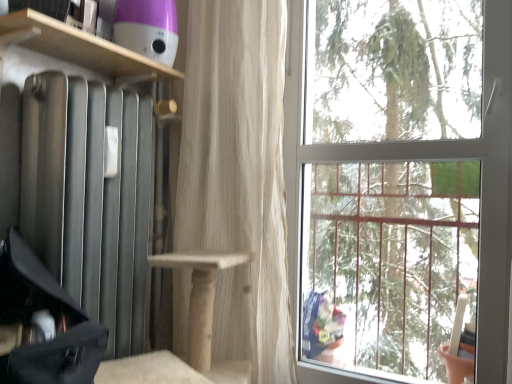
From the picture: What is the approximate height of white sheer curtain at center?

It is 1.56 meters.

This screenshot has height=384, width=512. In order to click on transparent glass window at upper right in this screenshot , I will do `click(399, 181)`.

Find the location of `wooden shelf at upper left`. wooden shelf at upper left is located at coordinates (82, 47).

At what (x,y) coordinates should I click in order to perform the action: click on black fabric suitcase at left. Please return your answer as a coordinate pair (x, y). Looking at the image, I should click on (51, 316).

Is white sheer curtain at center taller than transparent glass window at upper right?

Yes, white sheer curtain at center is taller than transparent glass window at upper right.

Looking at this image, is white sheer curtain at center not within transparent glass window at upper right?

white sheer curtain at center is positioned outside transparent glass window at upper right.

Consider the image. Could you tell me if white sheer curtain at center is turned towards transparent glass window at upper right?

No, white sheer curtain at center is not facing towards transparent glass window at upper right.

Is white sheer curtain at center wider or thinner than wooden shelf at upper left?

white sheer curtain at center is thinner than wooden shelf at upper left.

From a real-world perspective, who is located lower, white sheer curtain at center or wooden shelf at upper left?

white sheer curtain at center is physically lower.

Is white sheer curtain at center looking in the opposite direction of wooden shelf at upper left?

No, white sheer curtain at center is not facing the opposite direction of wooden shelf at upper left.

Which is behind, point (266, 6) or point (101, 62)?

The point (266, 6) is farther.

How distant is transparent glass window at upper right from wooden shelf at upper left?

The distance of transparent glass window at upper right from wooden shelf at upper left is 35.01 inches.

Does point (500, 334) lie in front of point (90, 52)?

No, it is not.

Are transparent glass window at upper right and wooden shelf at upper left beside each other?

No, transparent glass window at upper right is not with wooden shelf at upper left.

From a real-world perspective, between transparent glass window at upper right and wooden shelf at upper left, who is vertically lower?

From a 3D spatial view, transparent glass window at upper right is below.

From a real-world perspective, is black fabric suitcase at left physically above wooden shelf at upper left?

No.

Which object is positioned more to the left, black fabric suitcase at left or wooden shelf at upper left?

black fabric suitcase at left.

Is wooden shelf at upper left inside black fabric suitcase at left?

No, wooden shelf at upper left is located outside of black fabric suitcase at left.

Considering the sizes of objects black fabric suitcase at left and wooden shelf at upper left in the image provided, who is shorter, black fabric suitcase at left or wooden shelf at upper left?

wooden shelf at upper left is shorter.

Can you confirm if wooden shelf at upper left is positioned to the left of black fabric suitcase at left?

No.

Which of these two, wooden shelf at upper left or black fabric suitcase at left, is wider?

black fabric suitcase at left.

Is wooden shelf at upper left turned away from black fabric suitcase at left?

No.

Measure the distance from wooden shelf at upper left to black fabric suitcase at left.

A distance of 25.73 inches exists between wooden shelf at upper left and black fabric suitcase at left.

Based on the photo, which is farther, (345, 65) or (186, 248)?

Positioned behind is point (345, 65).

From a real-world perspective, which object stands above the other?

white sheer curtain at center is physically above.

Is transparent glass window at upper right oriented away from white sheer curtain at center?

No, transparent glass window at upper right is not facing the opposite direction of white sheer curtain at center.

Do you think transparent glass window at upper right is within white sheer curtain at center, or outside of it?

transparent glass window at upper right is spatially situated outside white sheer curtain at center.

Considering the relative positions of black fabric suitcase at left and transparent glass window at upper right in the image provided, is black fabric suitcase at left to the right of transparent glass window at upper right from the viewer's perspective?

In fact, black fabric suitcase at left is to the left of transparent glass window at upper right.

Is black fabric suitcase at left positioned far away from transparent glass window at upper right?

→ black fabric suitcase at left is far away from transparent glass window at upper right.

Is black fabric suitcase at left surrounding transparent glass window at upper right?

No, transparent glass window at upper right is not surrounded by black fabric suitcase at left.

From the image's perspective, between black fabric suitcase at left and transparent glass window at upper right, who is located below?

black fabric suitcase at left appears lower in the image.

Identify the location of window below the white sheer curtain at center (from the image's perspective). Image resolution: width=512 pixels, height=384 pixels. (399, 181).

Image resolution: width=512 pixels, height=384 pixels. What are the coordinates of `shelf that appears in front of the white sheer curtain at center` in the screenshot? It's located at (82, 47).

Based on their spatial positions, is wooden shelf at upper left or black fabric suitcase at left closer to transparent glass window at upper right?

wooden shelf at upper left is closer to transparent glass window at upper right.

Considering their positions, is black fabric suitcase at left positioned closer to wooden shelf at upper left than white sheer curtain at center?

white sheer curtain at center is closer to wooden shelf at upper left.

Estimate the real-world distances between objects in this image. Which object is further from black fabric suitcase at left, transparent glass window at upper right or wooden shelf at upper left?

transparent glass window at upper right lies further to black fabric suitcase at left than the other object.

Looking at the image, which one is located further to wooden shelf at upper left, white sheer curtain at center or transparent glass window at upper right?

transparent glass window at upper right is further to wooden shelf at upper left.

Based on their spatial positions, is black fabric suitcase at left or wooden shelf at upper left closer to transparent glass window at upper right?

wooden shelf at upper left lies closer to transparent glass window at upper right than the other object.

Based on their spatial positions, is white sheer curtain at center or wooden shelf at upper left further from black fabric suitcase at left?

white sheer curtain at center is further to black fabric suitcase at left.

Estimate the real-world distances between objects in this image. Which object is further from transparent glass window at upper right, white sheer curtain at center or black fabric suitcase at left?

black fabric suitcase at left.

When comparing their distances from black fabric suitcase at left, does transparent glass window at upper right or white sheer curtain at center seem closer?

white sheer curtain at center lies closer to black fabric suitcase at left than the other object.

Find the location of a particular element. Image resolution: width=512 pixels, height=384 pixels. shelf between black fabric suitcase at left and transparent glass window at upper right from left to right is located at coordinates (82, 47).

Identify the location of curtain between wooden shelf at upper left and transparent glass window at upper right from left to right. (238, 176).

Where is `curtain between black fabric suitcase at left and transparent glass window at upper right in the horizontal direction`? curtain between black fabric suitcase at left and transparent glass window at upper right in the horizontal direction is located at coordinates (x=238, y=176).

This screenshot has width=512, height=384. I want to click on shelf located between black fabric suitcase at left and white sheer curtain at center in the depth direction, so pos(82,47).